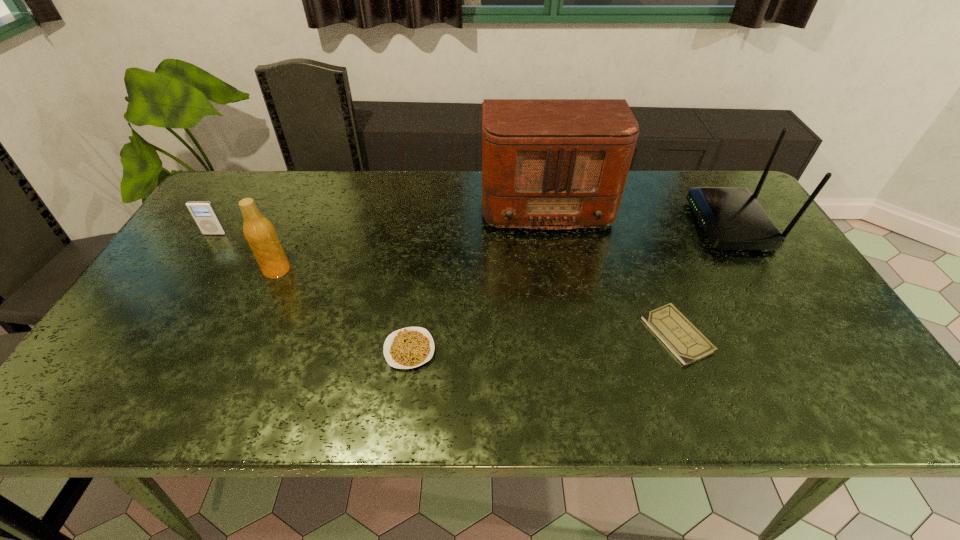
Locate an element on the screen. This screenshot has width=960, height=540. the tallest object is located at coordinates (546, 163).

Where is `the rightmost object`? the rightmost object is located at coordinates (x=732, y=219).

In order to click on beer bottle in this screenshot , I will do `click(259, 232)`.

This screenshot has width=960, height=540. Identify the location of the fifth object from right to left. [x=259, y=232].

Identify the location of the third shortest object. The image size is (960, 540). (203, 212).

In order to click on the leftmost object in this screenshot , I will do `click(203, 212)`.

I want to click on legume, so click(x=410, y=347).

At what (x,y) coordinates should I click in order to perform the action: click on the third object from left to right. Please return your answer as a coordinate pair (x, y). This screenshot has height=540, width=960. Looking at the image, I should click on (410, 347).

I want to click on checkbook, so click(x=681, y=337).

Locate an element on the screen. The width and height of the screenshot is (960, 540). vacant position located on the front panel of the tallest object is located at coordinates (569, 348).